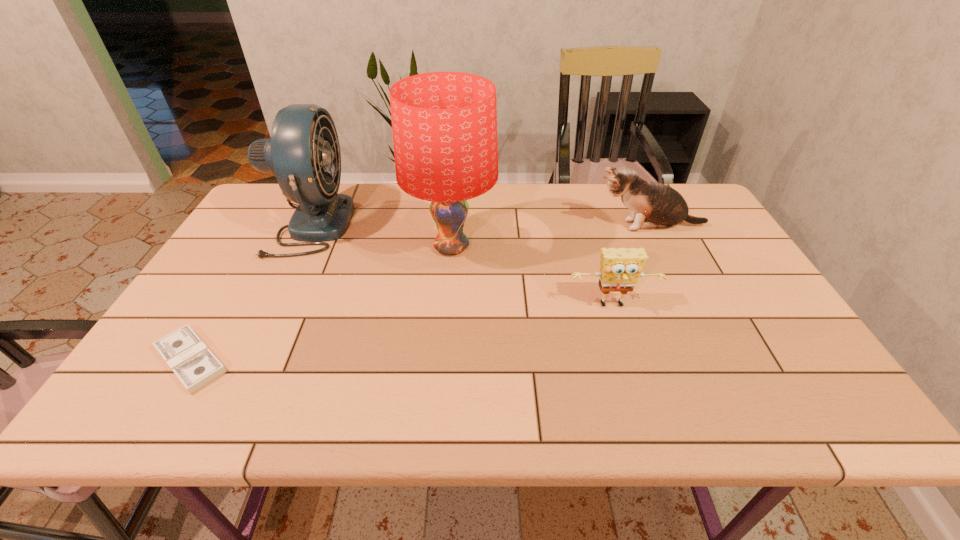
What are the coordinates of `lampshade` in the screenshot? It's located at (444, 124).

Locate an element on the screen. The height and width of the screenshot is (540, 960). the tallest object is located at coordinates (444, 124).

Where is `the second tallest object`? the second tallest object is located at coordinates (303, 152).

Locate an element on the screen. cat is located at coordinates (653, 205).

Locate an element on the screen. sponge is located at coordinates (621, 268).

Where is `the second shortest object`? the second shortest object is located at coordinates (621, 268).

The image size is (960, 540). I want to click on dollar, so click(190, 359).

The image size is (960, 540). In order to click on the nearest object in this screenshot , I will do `click(190, 359)`.

You are a GUI agent. You are given a task and a screenshot of the screen. Output one action in this format:
    pyautogui.click(x=<x>, y=<y>)
    Task: Click on the vacant space located 0.100m on the front-facing side of the tallest object
    The image size is (960, 540).
    Given the screenshot: What is the action you would take?
    pyautogui.click(x=531, y=247)

This screenshot has height=540, width=960. What are the coordinates of `blank area located 0.330m in front of the fan to blow air` in the screenshot? It's located at (457, 224).